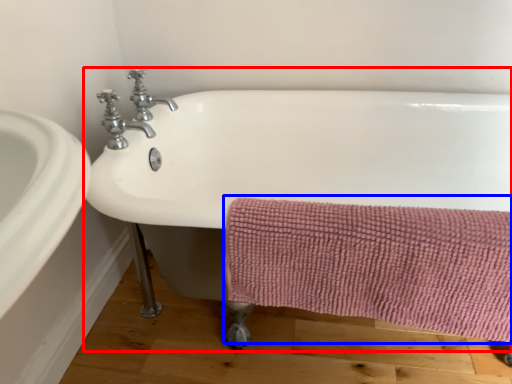
Question: Which object is further to the camera taking this photo, bathtub (highlighted by a red box) or bath towel (highlighted by a blue box)?

Choices:
 (A) bathtub
 (B) bath towel

Answer: (B)